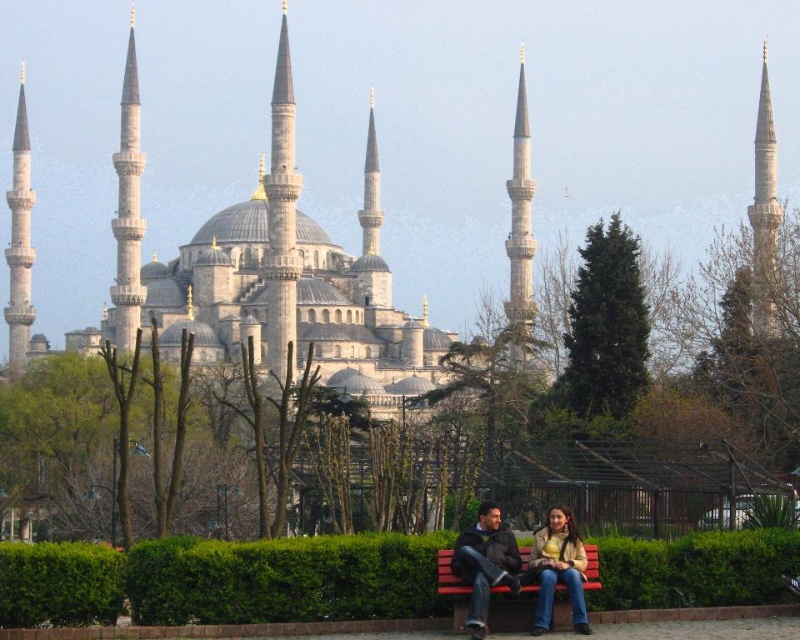
Question: Observing the image, what is the correct spatial positioning of jeans at center in reference to light brown leather jacket at lower center?

Choices:
 (A) above
 (B) below

Answer: (B)

Question: Which point appears farthest from the camera in this image?

Choices:
 (A) (556, 572)
 (B) (456, 540)

Answer: (B)

Question: In this image, where is jeans at center located relative to light brown leather jacket at lower center?

Choices:
 (A) left
 (B) right

Answer: (A)

Question: Among these objects, which one is farthest from the camera?

Choices:
 (A) dark brown leather jacket at lower center
 (B) jeans at center
 (C) light brown leather jacket at lower center

Answer: (C)

Question: Is jeans at center in front of dark brown leather jacket at lower center?

Choices:
 (A) no
 (B) yes

Answer: (B)

Question: Which of the following is the farthest from the observer?

Choices:
 (A) (548, 545)
 (B) (494, 515)

Answer: (A)